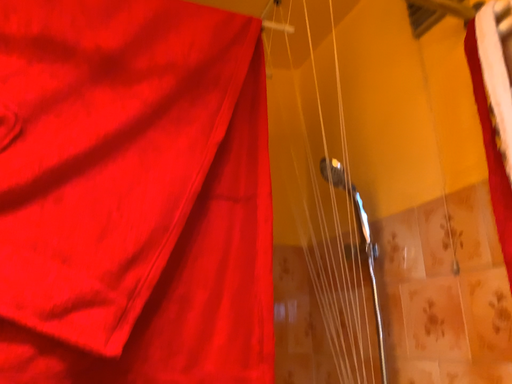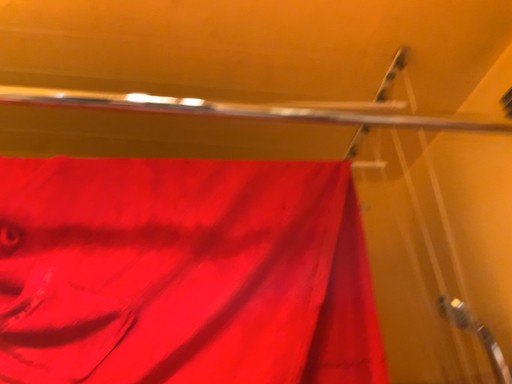
Question: Which way did the camera rotate in the video?

Choices:
 (A) rotated left
 (B) rotated right

Answer: (A)